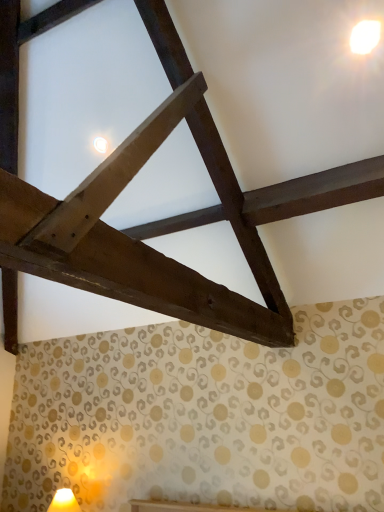
Question: Should I look upward or downward to see matte yellow table lamp at lower left?

Choices:
 (A) up
 (B) down

Answer: (B)

Question: Considering the relative sizes of matte yellow table lamp at lower left and white glossy light at upper right in the image provided, is matte yellow table lamp at lower left bigger than white glossy light at upper right?

Choices:
 (A) no
 (B) yes

Answer: (B)

Question: Can you confirm if matte yellow table lamp at lower left is positioned to the left of white glossy light at upper right?

Choices:
 (A) yes
 (B) no

Answer: (A)

Question: Is matte yellow table lamp at lower left facing away from white glossy light at upper right?

Choices:
 (A) yes
 (B) no

Answer: (B)

Question: From the image's perspective, would you say matte yellow table lamp at lower left is positioned over white glossy light at upper right?

Choices:
 (A) no
 (B) yes

Answer: (A)

Question: Considering the relative sizes of matte yellow table lamp at lower left and white glossy light at upper right in the image provided, is matte yellow table lamp at lower left smaller than white glossy light at upper right?

Choices:
 (A) no
 (B) yes

Answer: (A)

Question: Does matte yellow table lamp at lower left lie behind white glossy light at upper right?

Choices:
 (A) yes
 (B) no

Answer: (A)

Question: Would you say matte yellow table lamp at lower left is part of white glossy light at upper right's contents?

Choices:
 (A) no
 (B) yes

Answer: (A)

Question: From the image's perspective, does white glossy light at upper right appear higher than matte yellow table lamp at lower left?

Choices:
 (A) no
 (B) yes

Answer: (B)

Question: Does white glossy light at upper right have a lesser height compared to matte yellow table lamp at lower left?

Choices:
 (A) no
 (B) yes

Answer: (B)

Question: Is white glossy light at upper right turned away from matte yellow table lamp at lower left?

Choices:
 (A) yes
 (B) no

Answer: (B)

Question: From the image's perspective, does white glossy light at upper right appear lower than matte yellow table lamp at lower left?

Choices:
 (A) yes
 (B) no

Answer: (B)

Question: Is white glossy light at upper right to the right of matte yellow table lamp at lower left from the viewer's perspective?

Choices:
 (A) no
 (B) yes

Answer: (B)

Question: Is matte yellow table lamp at lower left in front of or behind white glossy light at upper right in the image?

Choices:
 (A) behind
 (B) front

Answer: (A)